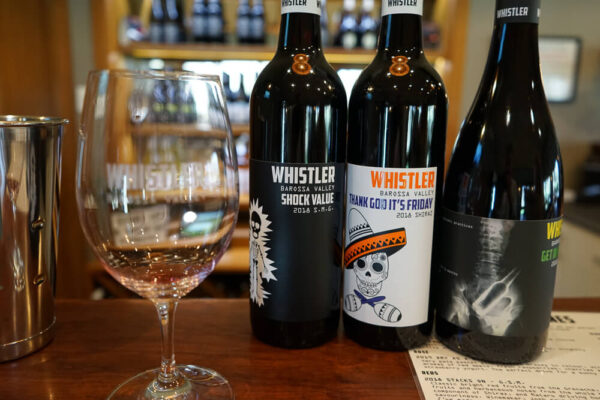
At what (x,y) coordinates should I click in order to perform the action: click on wine bottles. Please return your answer as a coordinate pair (x, y). The width and height of the screenshot is (600, 400). Looking at the image, I should click on (322, 233), (375, 222), (488, 225).